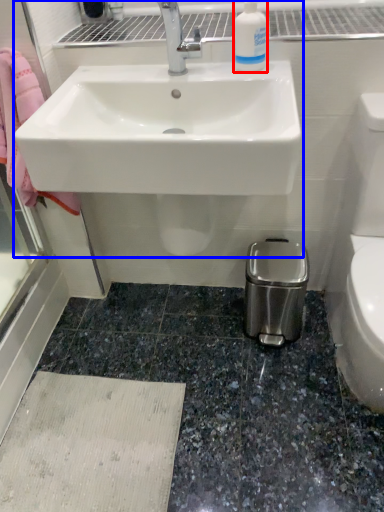
Question: Which object appears closest to the camera in this image, cleaning product (highlighted by a red box) or sink (highlighted by a blue box)?

Choices:
 (A) cleaning product
 (B) sink

Answer: (B)